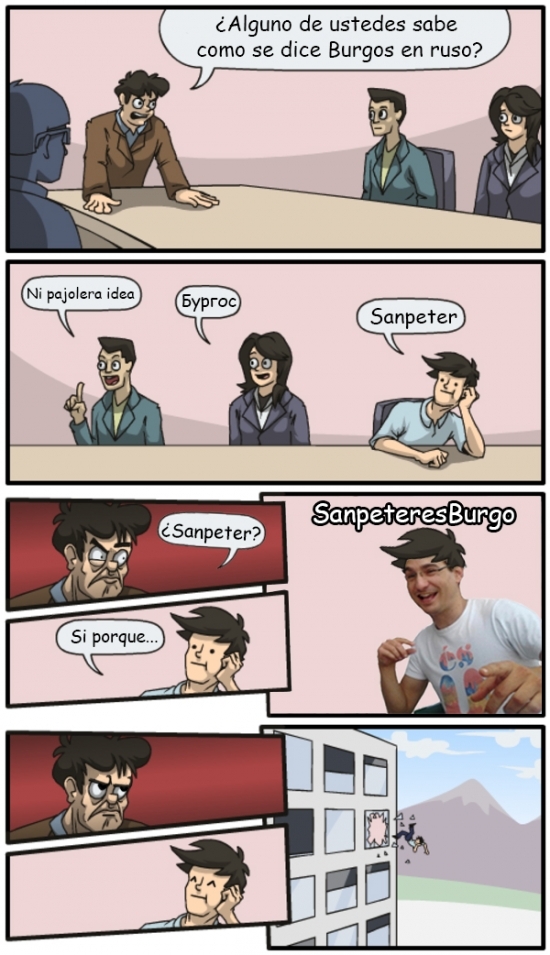
Where is `table`? This screenshot has height=955, width=550. table is located at coordinates (274, 220), (275, 452).